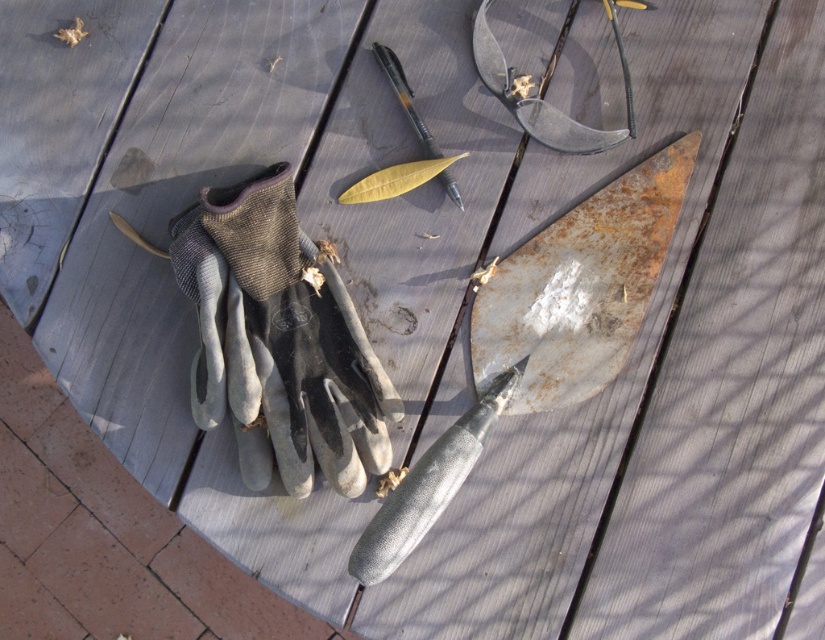
Does rusty metal blade at upper right have a lesser height compared to matte black pen at center?

No, rusty metal blade at upper right is not shorter than matte black pen at center.

Consider the image. Can you confirm if rusty metal blade at upper right is taller than matte black pen at center?

Correct, rusty metal blade at upper right is much taller as matte black pen at center.

At what (x,y) coordinates should I click in order to perform the action: click on rusty metal blade at upper right. Please return your answer as a coordinate pair (x, y). Looking at the image, I should click on point(578,289).

The image size is (825, 640). I want to click on rusty metal blade at upper right, so click(x=578, y=289).

Looking at this image, is gray fabric glove at center wider than matte black pen at center?

Correct, the width of gray fabric glove at center exceeds that of matte black pen at center.

Based on the photo, who is lower down, gray fabric glove at center or matte black pen at center?

gray fabric glove at center is lower down.

This screenshot has height=640, width=825. Identify the location of gray fabric glove at center. (280, 337).

Does gray fabric glove at center have a lesser width compared to rusty metal blade at upper right?

No, gray fabric glove at center is not thinner than rusty metal blade at upper right.

Does gray fabric glove at center appear on the right side of rusty metal blade at upper right?

Incorrect, gray fabric glove at center is not on the right side of rusty metal blade at upper right.

Between point (198, 396) and point (496, 321), which one is positioned in front?

Point (198, 396) is more forward.

In order to click on gray fabric glove at center in this screenshot , I will do (280, 337).